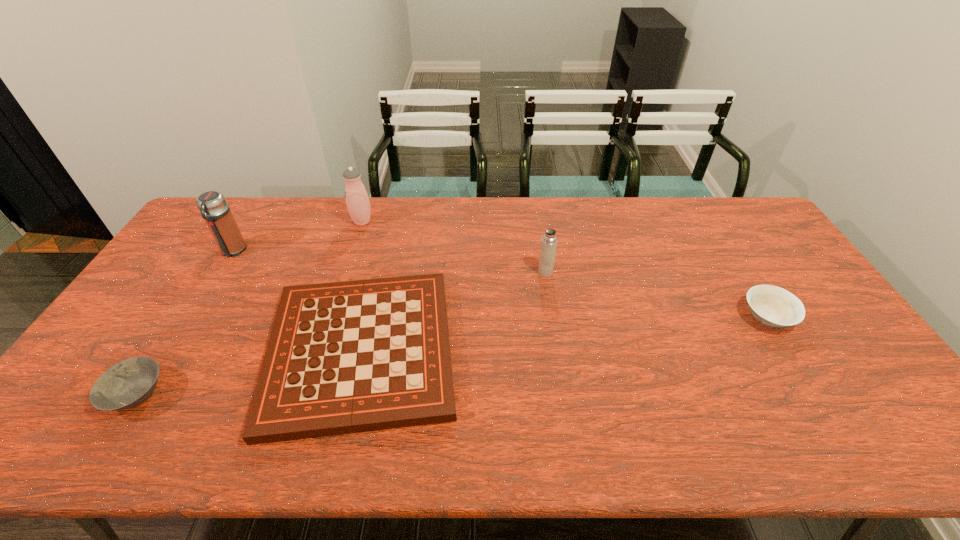
Where is `the farthest thermos bottle`? the farthest thermos bottle is located at coordinates (357, 200).

Find the location of a particular element. The image size is (960, 540). the second thermos bottle from left to right is located at coordinates (357, 200).

Find the location of `the leftmost thermos bottle`. the leftmost thermos bottle is located at coordinates (213, 206).

Image resolution: width=960 pixels, height=540 pixels. Identify the location of the second farthest thermos bottle. (213, 206).

Find the location of a particular element. The height and width of the screenshot is (540, 960). the fifth object from left to right is located at coordinates (549, 241).

At what (x,y) coordinates should I click in order to perform the action: click on the rightmost thermos bottle. Please return your answer as a coordinate pair (x, y). This screenshot has height=540, width=960. Looking at the image, I should click on (549, 241).

Find the location of a particular element. The height and width of the screenshot is (540, 960). the right bowl is located at coordinates coord(773,306).

Locate an element on the screen. the rightmost object is located at coordinates (773, 306).

You are a GUI agent. You are given a task and a screenshot of the screen. Output one action in this format:
    pyautogui.click(x=<x>, y=<y>)
    Task: Click on the left bowl
    Image resolution: width=960 pixels, height=540 pixels.
    Given the screenshot: What is the action you would take?
    pyautogui.click(x=127, y=384)

Identify the location of gameboard. (345, 357).